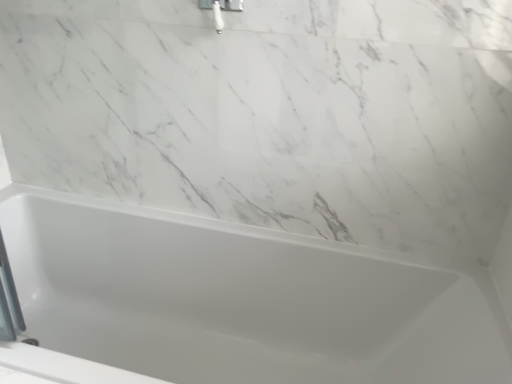
Question: Does point (x=417, y=281) appear closer or farther from the camera than point (x=221, y=29)?

Choices:
 (A) closer
 (B) farther

Answer: (B)

Question: From their relative heights in the image, would you say white glossy bathtub at center is taller or shorter than white glossy shower head at upper center?

Choices:
 (A) tall
 (B) short

Answer: (A)

Question: Is white glossy bathtub at center inside the boundaries of white glossy shower head at upper center, or outside?

Choices:
 (A) outside
 (B) inside

Answer: (A)

Question: Is white glossy shower head at upper center bigger or smaller than white glossy bathtub at center?

Choices:
 (A) big
 (B) small

Answer: (B)

Question: Visually, is white glossy shower head at upper center positioned to the left or to the right of white glossy bathtub at center?

Choices:
 (A) left
 (B) right

Answer: (B)

Question: Is white glossy shower head at upper center in front of or behind white glossy bathtub at center in the image?

Choices:
 (A) front
 (B) behind

Answer: (B)

Question: Considering the positions of white glossy shower head at upper center and white glossy bathtub at center in the image, is white glossy shower head at upper center taller or shorter than white glossy bathtub at center?

Choices:
 (A) tall
 (B) short

Answer: (B)